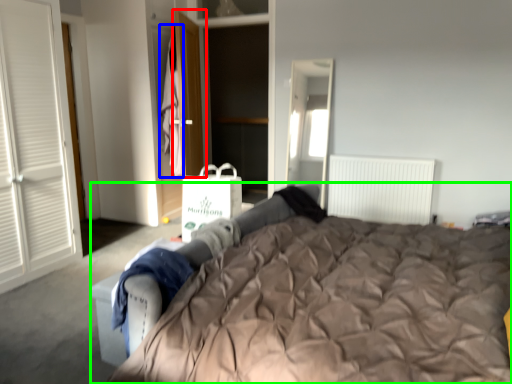
Question: Considering the real-world distances, which object is farthest from door (highlighted by a red box)? laundry (highlighted by a blue box) or bed (highlighted by a green box)?

Choices:
 (A) laundry
 (B) bed

Answer: (B)